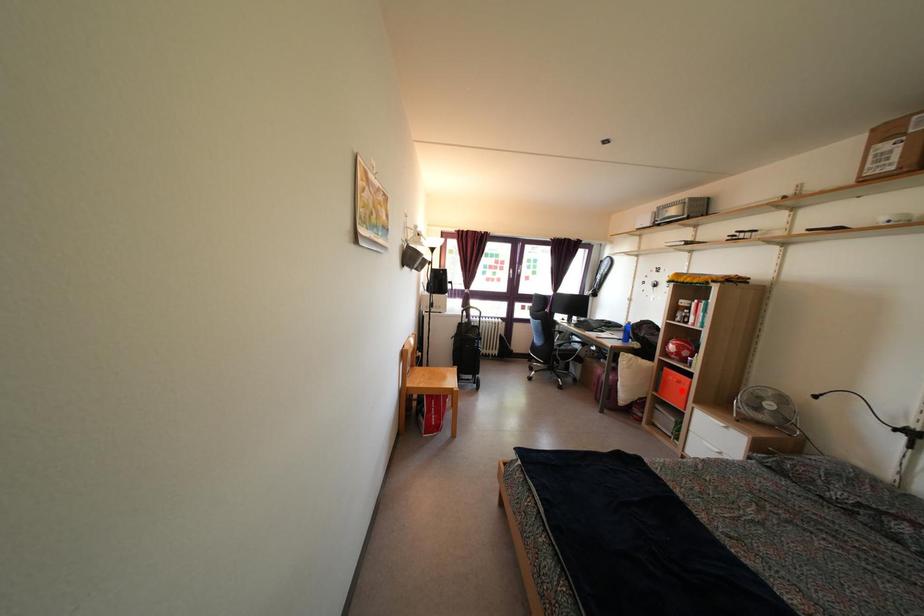
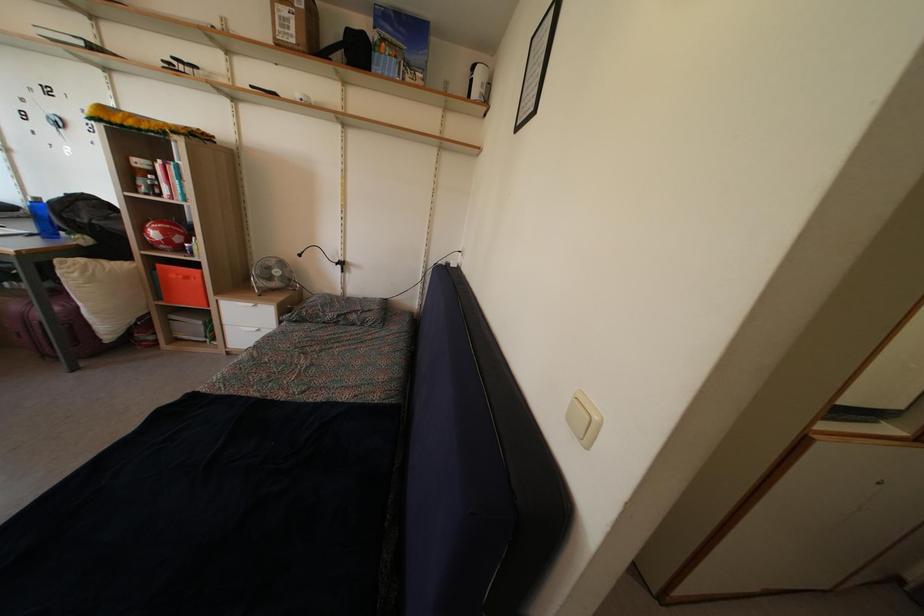
Question: I am providing you with two images of the same scene from different viewpoints. A red point is shown in image1. For the corresponding object point in image2, is it positioned nearer or farther from the camera?

Choices:
 (A) Nearer
 (B) Farther

Answer: (B)